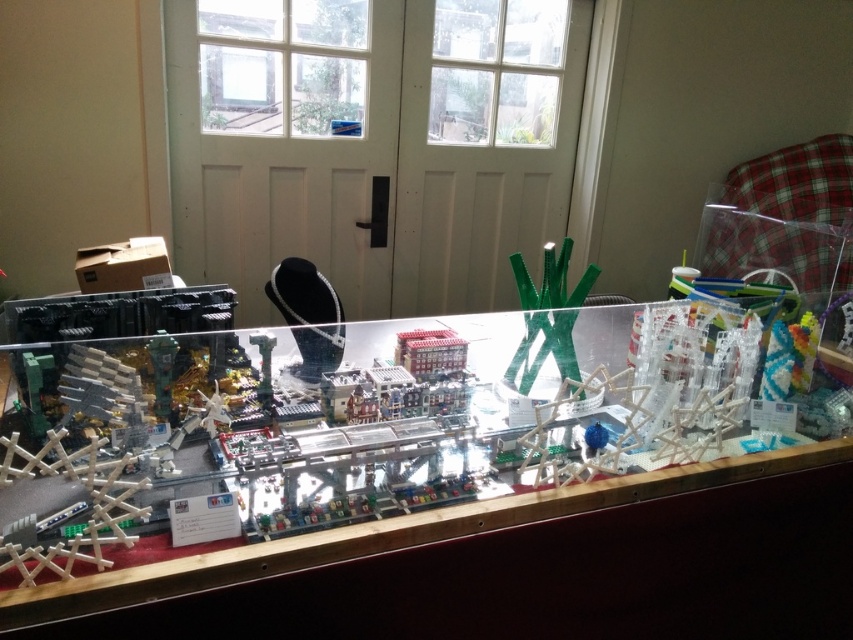
In the scene shown: You are a delivery robot with a package that measures 45 centimeters in length. You need to place it between the clear plastic table at center and the green matte plastic x at center in the display case. Is there enough space to fit the package between them?

The distance between the clear plastic table at center and the green matte plastic x at center is 42.45 centimeters. Since the package is 45 centimeters long, it is slightly longer than the available space. Therefore, the package cannot fit between them.

You are a visitor at the LEGO display case and want to place a small LEGO figure on the clear plastic table at center. However, you notice another LEGO piece, the green matte plastic x at center, nearby. Based on their positions, can you determine which object is more to the left?

The clear plastic table at center is positioned on the left side of green matte plastic x at center, so the clear plastic table at center is more to the left.

You are a delivery robot with a package that needs to be placed between the two points marked as point A at [511,368] and point B at 0.600, 0.625. The package requires a minimum of 5 feet of space to be safely placed. Can you fit the package between these two points?

The distance between point A at [511,368] and point B at 0.600, 0.625 is 4.86 feet, which is less than the required 5 feet. Therefore, the package cannot be safely placed between these two points.